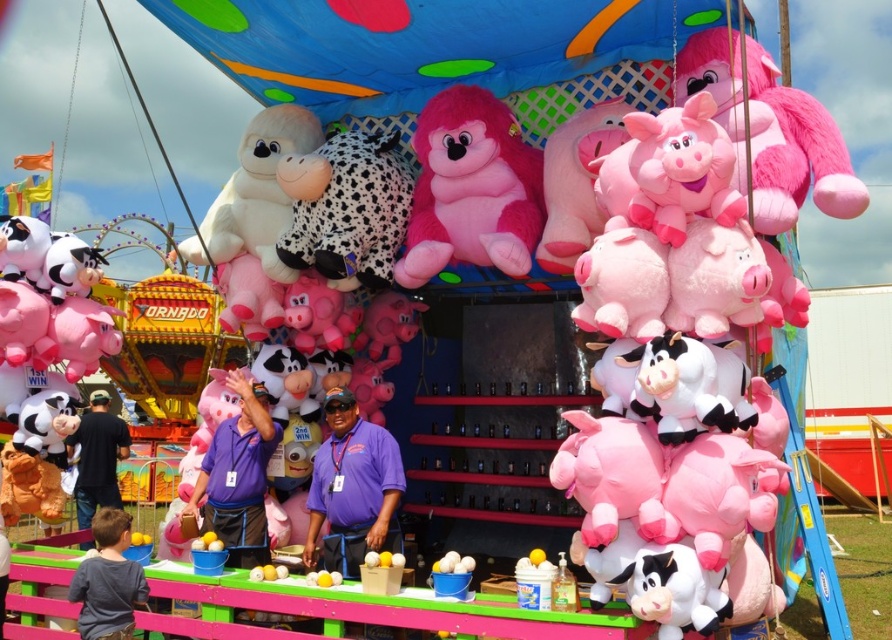
You are a child trying to grab a prize from the booth. You see the pink plush gorilla at center and the fluffy pink plush monkey at upper right. Which one do you think you can reach first if you start from the front of the booth?

The pink plush gorilla at center is wider than the fluffy pink plush monkey at upper right, so you can reach the fluffy pink plush monkey at upper right first because it is closer to you.

You are a child trying to grab a prize from the carnival booth. You see the spotted black and white plush at center and the white plush monkey at upper center. Which one do you think is taller?

The spotted black and white plush at center is much taller than the white plush monkey at upper center, so you should aim for the spotted black and white plush at center if you want a taller prize.

You are standing in front of the carnival prize booth and want to grab the spotted black and white plush at center. Based on the coordinates provided, can you determine its exact position relative to the booth?

The spotted black and white plush at center is located at the coordinates point (345, 209), which means it is positioned slightly to the left and lower center of the booth.